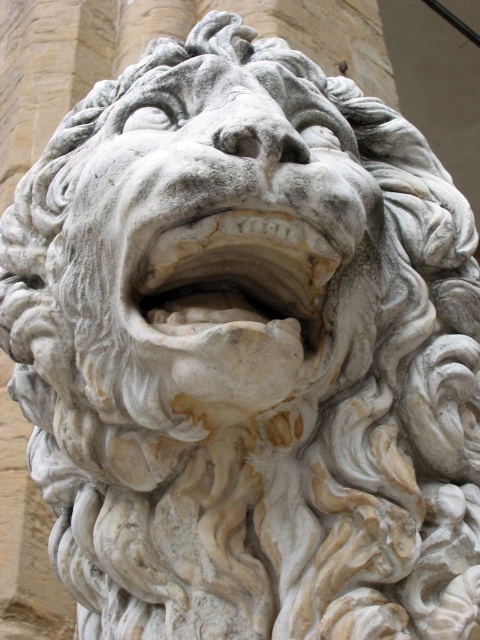
Question: Which object appears closest to the camera in this image?

Choices:
 (A) white stone mouth at center
 (B) white stone lion head at center

Answer: (B)

Question: Which of the following is the farthest from the observer?

Choices:
 (A) (241, 243)
 (B) (139, 225)

Answer: (A)

Question: Can you confirm if white stone lion head at center is bigger than white stone mouth at center?

Choices:
 (A) no
 (B) yes

Answer: (B)

Question: Does white stone lion head at center have a greater width compared to white stone mouth at center?

Choices:
 (A) yes
 (B) no

Answer: (A)

Question: Can you confirm if white stone lion head at center is positioned to the left of white stone mouth at center?

Choices:
 (A) no
 (B) yes

Answer: (B)